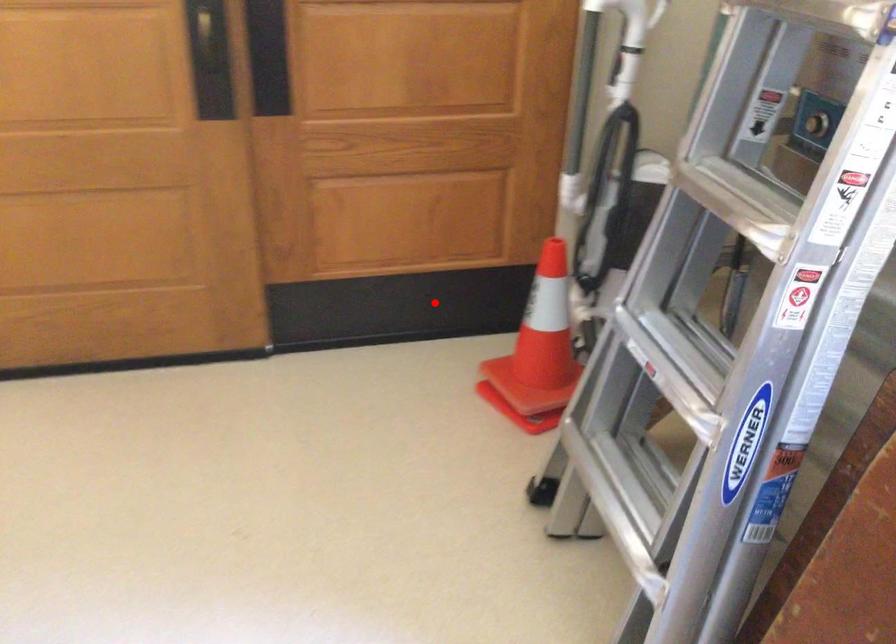
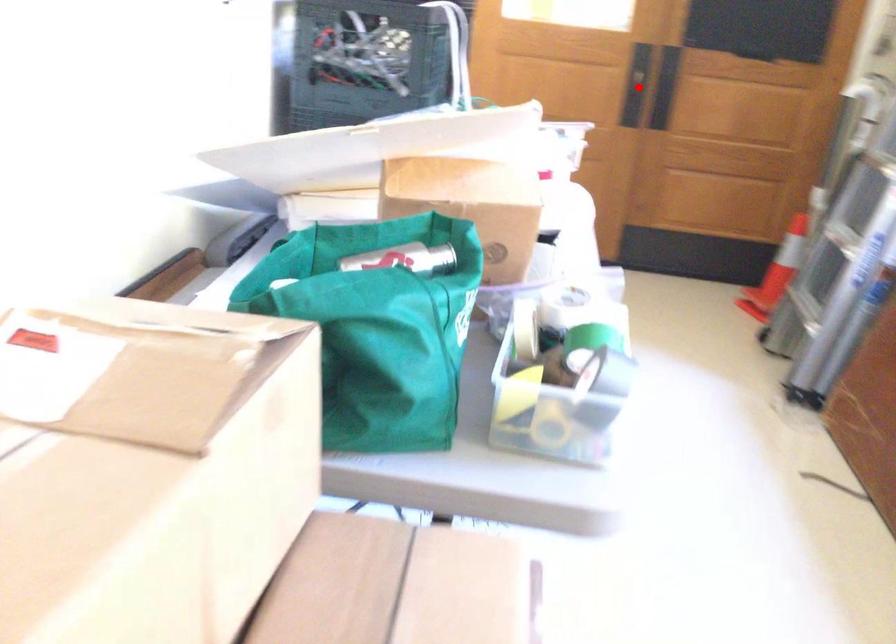
I am providing you with two images of the same scene from different viewpoints. A red point is marked on the first image and another point is marked on the second image. Is the red point in image1 aligned with the point shown in image2?

No